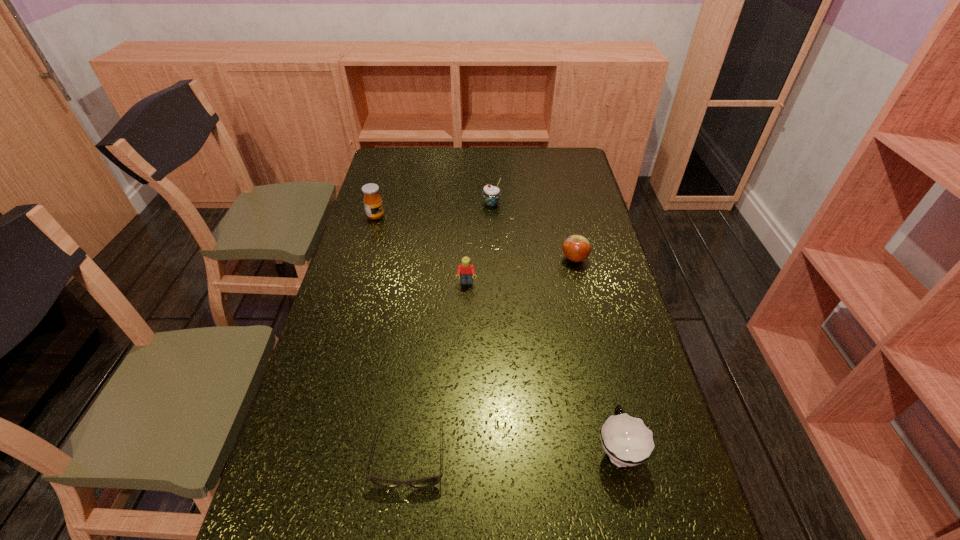
This screenshot has height=540, width=960. In the image, there is a desktop. What are the coordinates of `vacant space at the left edge` in the screenshot? It's located at (290, 530).

You are a GUI agent. You are given a task and a screenshot of the screen. Output one action in this format:
    pyautogui.click(x=<x>, y=<y>)
    Task: Click on the vacant space at the right edge of the desktop
    Image resolution: width=960 pixels, height=540 pixels.
    Given the screenshot: What is the action you would take?
    pyautogui.click(x=619, y=401)

At what (x,y) coordinates should I click in order to perform the action: click on free space that is in between the cup and the fifth object from right to left. Please return your answer as a coordinate pair (x, y). This screenshot has height=540, width=960. Looking at the image, I should click on (514, 451).

Find the location of a particular element. This screenshot has width=960, height=540. vacant area that lies between the fourth object from left to right and the fourth farthest object is located at coordinates (479, 243).

The image size is (960, 540). What are the coordinates of `empty location between the cupcake and the cup` in the screenshot? It's located at (554, 326).

Where is `free spot between the Lego and the third farthest object`? The height and width of the screenshot is (540, 960). free spot between the Lego and the third farthest object is located at coordinates (520, 271).

You are a GUI agent. You are given a task and a screenshot of the screen. Output one action in this format:
    pyautogui.click(x=<x>, y=<y>)
    Task: Click on the vacant area between the third farthest object and the sunglasses
    Image resolution: width=960 pixels, height=540 pixels.
    Given the screenshot: What is the action you would take?
    pyautogui.click(x=492, y=355)

This screenshot has height=540, width=960. What are the coordinates of `free space between the shortest object and the third object from right to left` in the screenshot? It's located at (450, 328).

Identify the location of vacant space that is in between the cup and the fourth object from right to left. The width and height of the screenshot is (960, 540). (542, 366).

You are a GUI agent. You are given a task and a screenshot of the screen. Output one action in this format:
    pyautogui.click(x=<x>, y=<y>)
    Task: Click on the unoccupied position between the apple and the leftmost object
    The height and width of the screenshot is (540, 960).
    Given the screenshot: What is the action you would take?
    pyautogui.click(x=475, y=238)